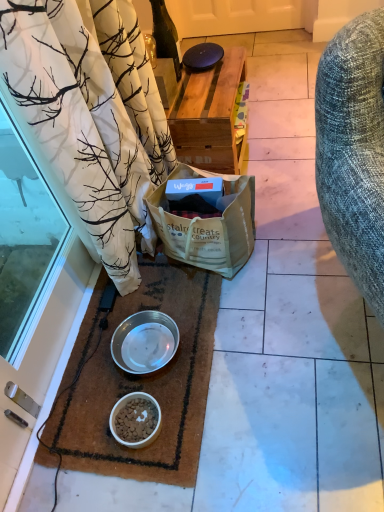
This screenshot has width=384, height=512. I want to click on white matte bowl at lower center, which is the 2th bowl from top to bottom, so click(x=135, y=420).

What do you see at coordinates (166, 35) in the screenshot? I see `green glass bottle at upper center` at bounding box center [166, 35].

Where is `brown woven mat at lower left`? The image size is (384, 512). brown woven mat at lower left is located at coordinates 141,380.

Could you tell me if green glass bottle at upper center is turned towards brown woven mat at lower left?

No, green glass bottle at upper center is not aimed at brown woven mat at lower left.

Does point (174, 26) lie in front of point (177, 396)?

No, (174, 26) is further to viewer.

Is green glass bottle at upper center to the left of brown woven mat at lower left from the viewer's perspective?

Incorrect, green glass bottle at upper center is not on the left side of brown woven mat at lower left.

From the picture: Considering the relative positions of green glass bottle at upper center and brown woven mat at lower left in the image provided, is green glass bottle at upper center in front of brown woven mat at lower left?

No, green glass bottle at upper center is further to the viewer.

Looking at this image, from a real-world perspective, relative to transparent glass door at lower left, is white cardboard box at center vertically above or below?

In terms of real-world spatial position, white cardboard box at center is below transparent glass door at lower left.

Image resolution: width=384 pixels, height=512 pixels. Identify the location of glass door located on the left of white cardboard box at center. (24, 240).

Is white cardboard box at center turned away from transparent glass door at lower left?

No, transparent glass door at lower left is not at the back of white cardboard box at center.

Does point (154, 399) come behind point (185, 266)?

No, (154, 399) is in front of (185, 266).

Which object is positioned more to the left, white matte bowl at lower center, which is the 2th bowl from top to bottom, or brown woven mat at lower left?

brown woven mat at lower left.

What's the angular difference between white matte bowl at lower center, placed as the first bowl when sorted from bottom to top, and brown woven mat at lower left's facing directions?

90 degrees separate the facing orientations of white matte bowl at lower center, placed as the first bowl when sorted from bottom to top, and brown woven mat at lower left.

Between white matte bowl at lower center, placed as the first bowl when sorted from bottom to top, and green glass bottle at upper center, which one appears on the right side from the viewer's perspective?

green glass bottle at upper center.

In the scene shown: From a real-world perspective, who is located lower, white matte bowl at lower center, placed as the first bowl when sorted from bottom to top, or green glass bottle at upper center?

From a 3D spatial view, white matte bowl at lower center, placed as the first bowl when sorted from bottom to top, is below.

From their relative heights in the image, would you say white matte bowl at lower center, which is the 2th bowl from top to bottom, is taller or shorter than green glass bottle at upper center?

In the image, white matte bowl at lower center, which is the 2th bowl from top to bottom, appears to be shorter than green glass bottle at upper center.

How much distance is there between white matte bowl at lower center, placed as the first bowl when sorted from bottom to top, and green glass bottle at upper center?

They are 3.84 feet apart.

From the image's perspective, is white matte bowl at lower center, placed as the first bowl when sorted from bottom to top, located beneath black glossy tile at center?

Indeed, from the image's perspective, white matte bowl at lower center, placed as the first bowl when sorted from bottom to top, is shown beneath black glossy tile at center.

Is point (150, 428) closer to camera compared to point (230, 36)?

Yes, it is.

Is black glossy tile at center surrounded by white matte bowl at lower center, placed as the first bowl when sorted from bottom to top?

Actually, black glossy tile at center is outside white matte bowl at lower center, placed as the first bowl when sorted from bottom to top.

Is white matte bowl at lower center, which is the 2th bowl from top to bottom, beside black glossy tile at center?

No, white matte bowl at lower center, which is the 2th bowl from top to bottom, is not touching black glossy tile at center.

Is white cardboard box at center in contact with green glass bottle at upper center?

There is a gap between white cardboard box at center and green glass bottle at upper center.

Is white cardboard box at center at the right side of green glass bottle at upper center?

Correct, you'll find white cardboard box at center to the right of green glass bottle at upper center.

From a real-world perspective, is white cardboard box at center located higher than green glass bottle at upper center?

No, from a real-world perspective, white cardboard box at center is not above green glass bottle at upper center.

What are the coordinates of `bowl behind the white matte bowl at lower center, placed as the first bowl when sorted from bottom to top` in the screenshot? It's located at (145, 342).

Could you tell me if white matte bowl at lower center, placed as the first bowl when sorted from bottom to top, is turned towards metallic silver bowl at lower center, arranged as the first bowl when viewed from the top?

No, white matte bowl at lower center, placed as the first bowl when sorted from bottom to top, is not facing towards metallic silver bowl at lower center, arranged as the first bowl when viewed from the top.

Who is bigger, white matte bowl at lower center, placed as the first bowl when sorted from bottom to top, or metallic silver bowl at lower center, acting as the 2th bowl starting from the bottom?

metallic silver bowl at lower center, acting as the 2th bowl starting from the bottom, is bigger.

Is point (140, 400) closer or farther from the camera than point (158, 328)?

Point (140, 400) is closer to the camera than point (158, 328).

The width and height of the screenshot is (384, 512). Find the location of `mat on the left of the green glass bottle at upper center`. mat on the left of the green glass bottle at upper center is located at coordinates click(141, 380).

The width and height of the screenshot is (384, 512). I want to click on glass door lying below the white cardboard box at center (from the image's perspective), so click(24, 240).

From the image, which object appears to be nearer to metallic silver bowl at lower center, acting as the 2th bowl starting from the bottom, white matte bowl at lower center, placed as the first bowl when sorted from bottom to top, or green glass bottle at upper center?

Based on the image, white matte bowl at lower center, placed as the first bowl when sorted from bottom to top, appears to be nearer to metallic silver bowl at lower center, acting as the 2th bowl starting from the bottom.

Estimate the real-world distances between objects in this image. Which object is further from metallic silver bowl at lower center, arranged as the first bowl when viewed from the top, black glossy tile at center or white matte bowl at lower center, placed as the first bowl when sorted from bottom to top?

Among the two, black glossy tile at center is located further to metallic silver bowl at lower center, arranged as the first bowl when viewed from the top.

Based on their spatial positions, is brown woven mat at lower left or black glossy tile at center further from metallic silver bowl at lower center, arranged as the first bowl when viewed from the top?

Among the two, black glossy tile at center is located further to metallic silver bowl at lower center, arranged as the first bowl when viewed from the top.

Which object lies nearer to the anchor point metallic silver bowl at lower center, acting as the 2th bowl starting from the bottom, green glass bottle at upper center or white cardboard box at center?

white cardboard box at center is closer to metallic silver bowl at lower center, acting as the 2th bowl starting from the bottom.

Estimate the real-world distances between objects in this image. Which object is further from metallic silver bowl at lower center, arranged as the first bowl when viewed from the top, black glossy tile at center or transparent glass door at lower left?

black glossy tile at center lies further to metallic silver bowl at lower center, arranged as the first bowl when viewed from the top, than the other object.

Looking at the image, which one is located further to white cardboard box at center, white matte bowl at lower center, placed as the first bowl when sorted from bottom to top, or black glossy tile at center?

black glossy tile at center lies further to white cardboard box at center than the other object.

Based on the photo, from the image, which object appears to be nearer to white cardboard box at center, transparent glass door at lower left or metallic silver bowl at lower center, acting as the 2th bowl starting from the bottom?

metallic silver bowl at lower center, acting as the 2th bowl starting from the bottom.

Considering their positions, is transparent glass door at lower left positioned closer to white matte bowl at lower center, placed as the first bowl when sorted from bottom to top, than metallic silver bowl at lower center, arranged as the first bowl when viewed from the top?

metallic silver bowl at lower center, arranged as the first bowl when viewed from the top, lies closer to white matte bowl at lower center, placed as the first bowl when sorted from bottom to top, than the other object.

Where is `bottle between transparent glass door at lower left and black glossy tile at center in the front-back direction`? bottle between transparent glass door at lower left and black glossy tile at center in the front-back direction is located at coordinates (166, 35).

At what (x,y) coordinates should I click in order to perform the action: click on bowl that lies between green glass bottle at upper center and white matte bowl at lower center, placed as the first bowl when sorted from bottom to top, from top to bottom. Please return your answer as a coordinate pair (x, y). Looking at the image, I should click on (145, 342).

You are a GUI agent. You are given a task and a screenshot of the screen. Output one action in this format:
    pyautogui.click(x=<x>, y=<y>)
    Task: Click on the glass door between green glass bottle at upper center and metallic silver bowl at lower center, arranged as the first bowl when viewed from the top, from top to bottom
    
    Given the screenshot: What is the action you would take?
    pyautogui.click(x=24, y=240)

This screenshot has width=384, height=512. I want to click on bottle between black glossy tile at center and metallic silver bowl at lower center, arranged as the first bowl when viewed from the top, vertically, so click(x=166, y=35).